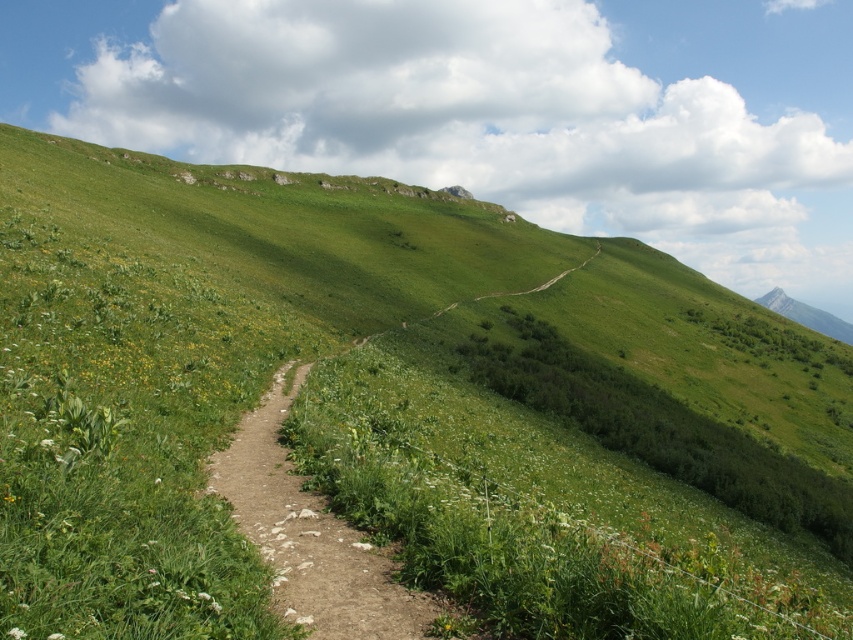
Is dirt path at center smaller than gray rocky mountain at upper right?

Indeed, dirt path at center has a smaller size compared to gray rocky mountain at upper right.

Can you confirm if dirt path at center is positioned to the left of gray rocky mountain at upper right?

Indeed, dirt path at center is positioned on the left side of gray rocky mountain at upper right.

Identify the location of dirt path at center. The height and width of the screenshot is (640, 853). (310, 534).